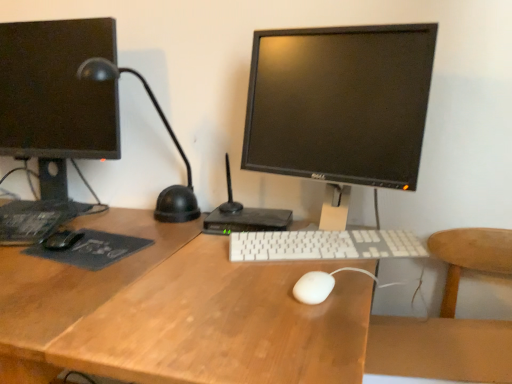
Image resolution: width=512 pixels, height=384 pixels. Find the location of `vacant space to the right of dark gray matte mousepad at left`. vacant space to the right of dark gray matte mousepad at left is located at coordinates (169, 244).